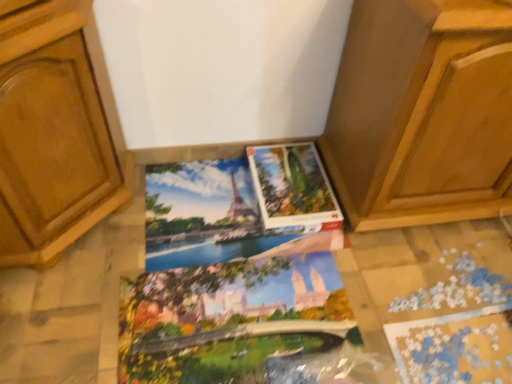
What are the coordinates of `free space between matte paper coloring book at center, positioned as the 2th coloring book in top-to-bottom order, and matte paper coloring book at center, placed as the 2th coloring book when sorted from bottom to top` in the screenshot? It's located at (262, 269).